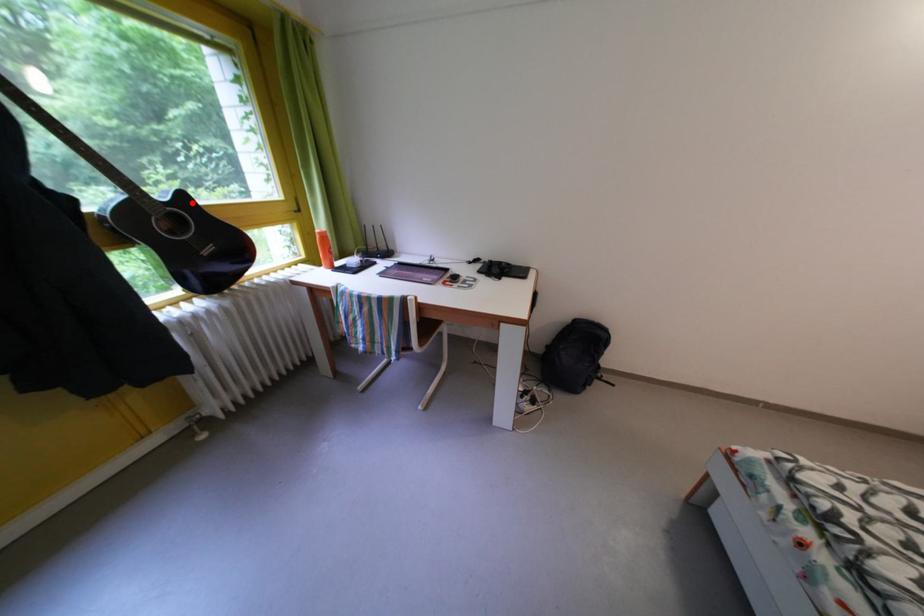
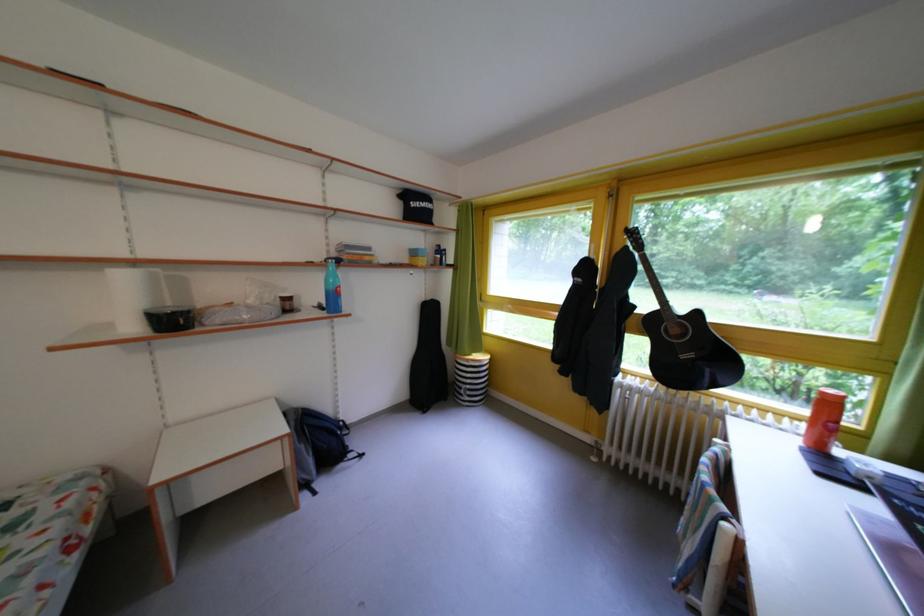
The point at the highlighted location is marked in the first image. Where is the corresponding point in the second image?

(707, 320)